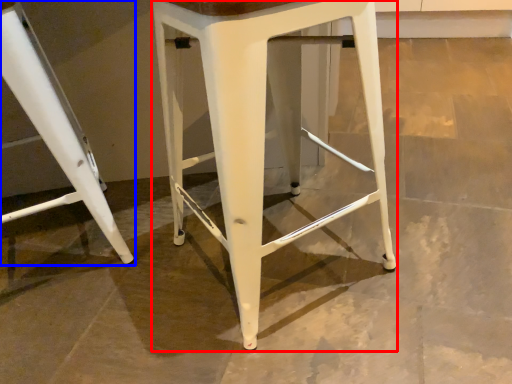
Question: Among these objects, which one is farthest to the camera, stool (highlighted by a red box) or stool (highlighted by a blue box)?

Choices:
 (A) stool
 (B) stool

Answer: (B)